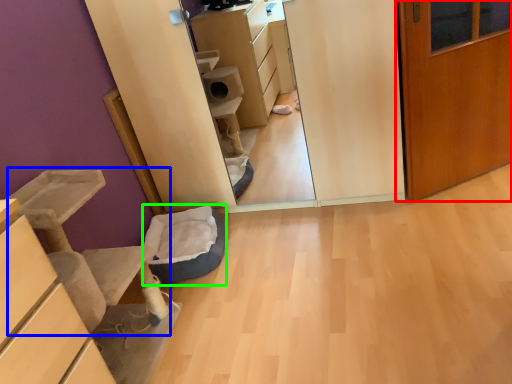
Question: Which object is positioned closest to door (highlighted by a red box)? Select from furniture (highlighted by a blue box) and cat bed (highlighted by a green box).

Choices:
 (A) furniture
 (B) cat bed

Answer: (B)